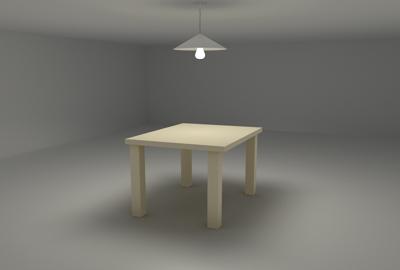
Locate an element on the screen. The width and height of the screenshot is (400, 270). lightbulb is located at coordinates (201, 57).